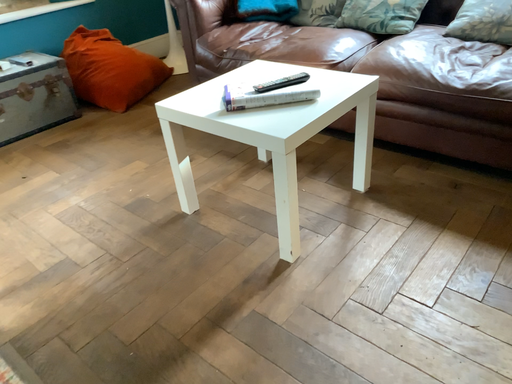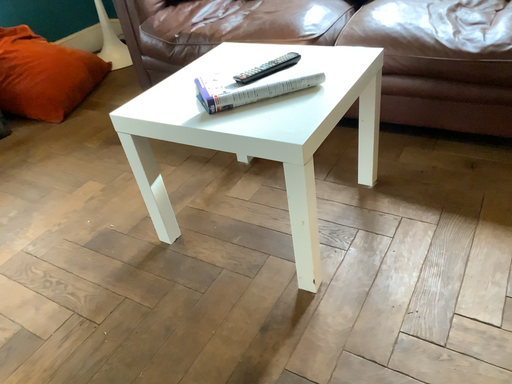
Question: Which way did the camera rotate in the video?

Choices:
 (A) rotated right
 (B) rotated left

Answer: (A)